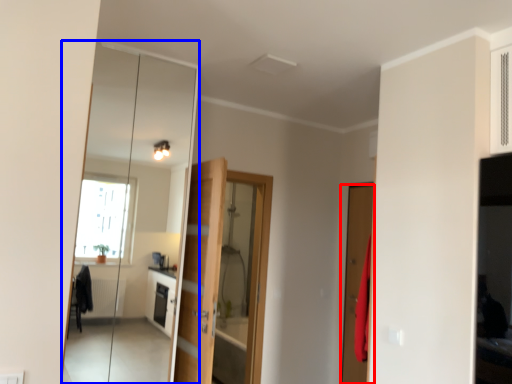
Question: Which object is further to the camera taking this photo, door (highlighted by a red box) or mirror (highlighted by a blue box)?

Choices:
 (A) door
 (B) mirror

Answer: (A)